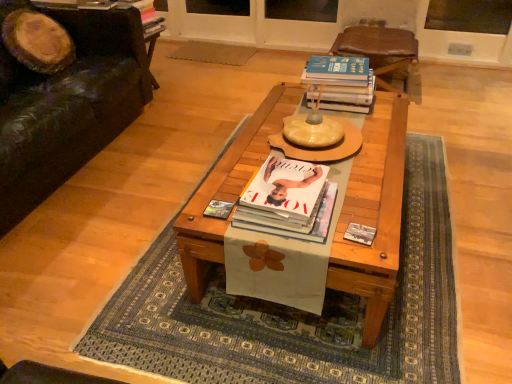
The width and height of the screenshot is (512, 384). Identify the location of free spot in front of matte paper magazine at center. (225, 233).